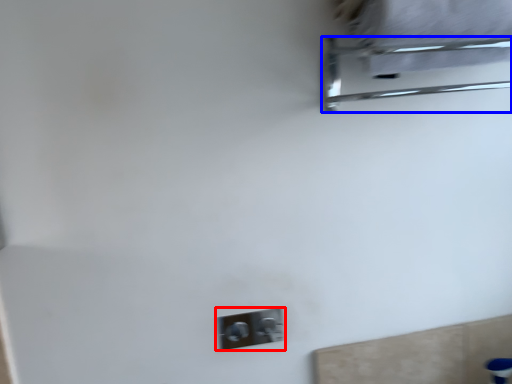
Question: Which point is further to the camera, light switch (highlighted by a red box) or furniture (highlighted by a blue box)?

Choices:
 (A) light switch
 (B) furniture

Answer: (A)